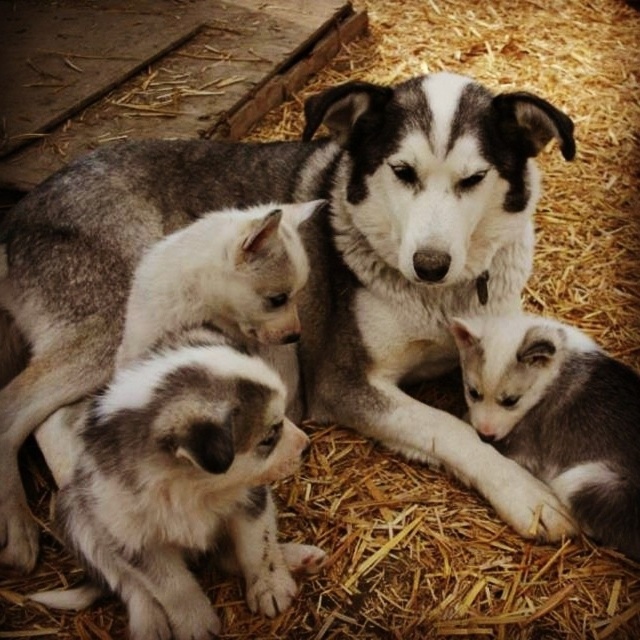
Between gray and white fur puppy at lower left and white fur puppy at center, which one appears on the left side from the viewer's perspective?

white fur puppy at center

Consider the image. Between gray and white fur puppy at lower left and white fur puppy at center, which one has less height?

Standing shorter between the two is white fur puppy at center.

Image resolution: width=640 pixels, height=640 pixels. I want to click on gray and white fur puppy at lower left, so click(184, 483).

Which of these two, golden straw bed at center or white fur puppy at center, stands taller?

With more height is golden straw bed at center.

Is golden straw bed at center above white fur puppy at center?

Indeed, golden straw bed at center is positioned over white fur puppy at center.

Is point (624, 38) in front of point (230, 252)?

No, (624, 38) is behind (230, 252).

The height and width of the screenshot is (640, 640). Find the location of `golden straw bed at center`. golden straw bed at center is located at coordinates (547, 147).

Does gray and white fur dog at center appear over white fur puppy at center?

No.

Who is higher up, gray and white fur dog at center or white fur puppy at center?

white fur puppy at center

Between point (502, 474) and point (125, 355), which one is positioned in front?

Point (125, 355) is more forward.

Where is `gray and white fur dog at center`? The height and width of the screenshot is (640, 640). gray and white fur dog at center is located at coordinates coord(308,259).